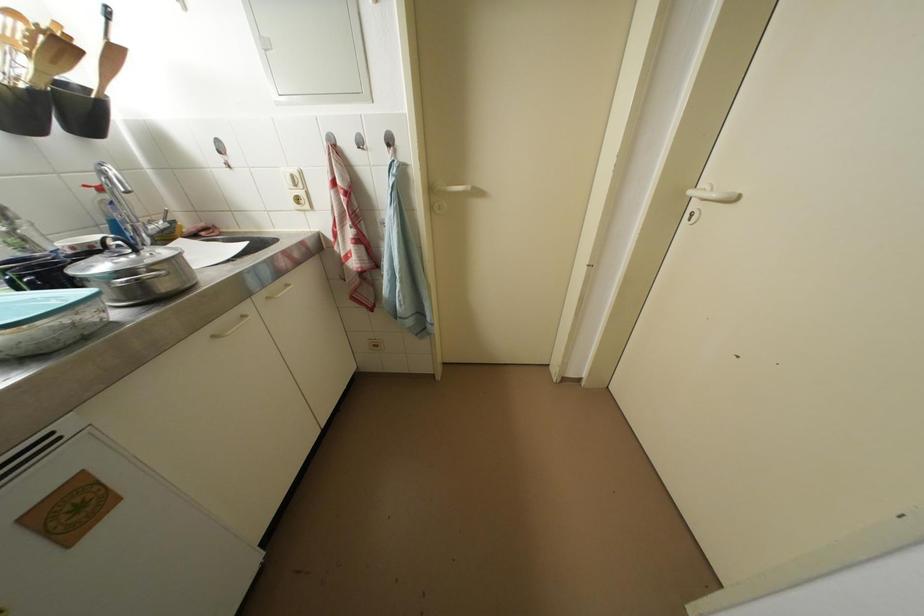
This screenshot has width=924, height=616. I want to click on black pot lid handle, so click(116, 244).